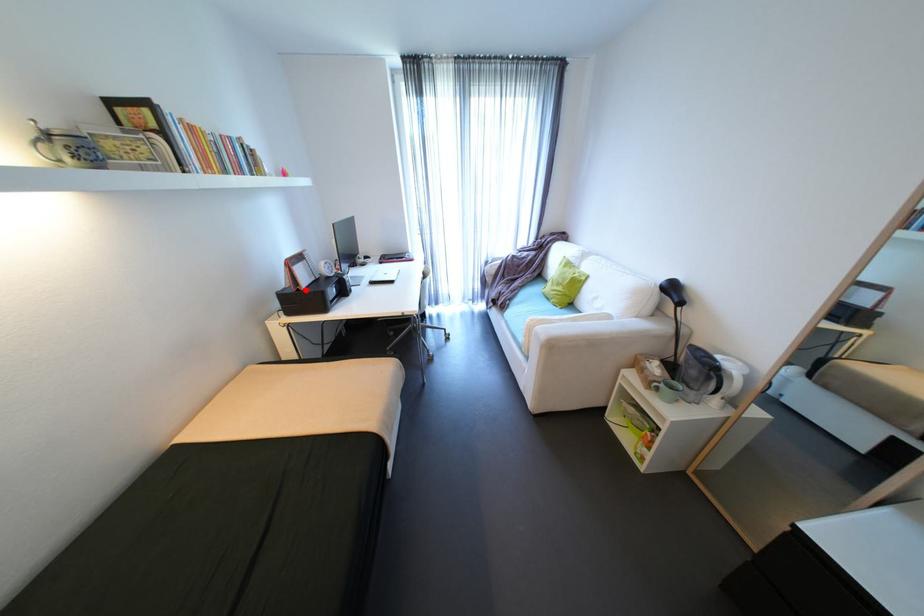
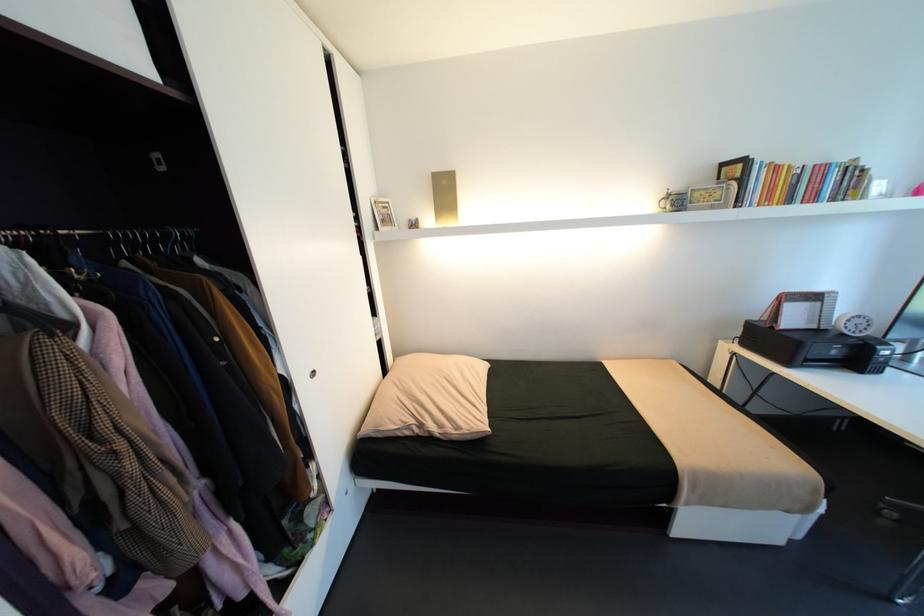
Where in the second image is the point corresponding to the highlighted location from the first image?

(779, 328)